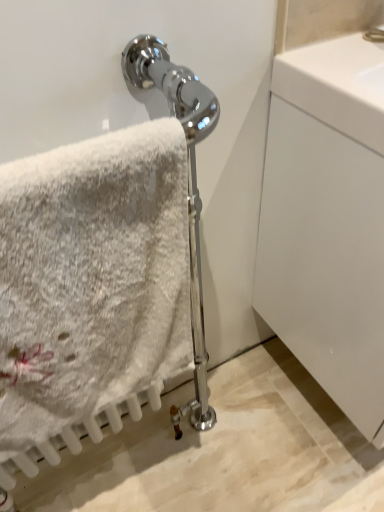
Question: Does white fluffy towel at left lie in front of white glossy cabinet at right?

Choices:
 (A) yes
 (B) no

Answer: (A)

Question: Is white fluffy towel at left not within white glossy cabinet at right?

Choices:
 (A) yes
 (B) no

Answer: (A)

Question: Can you confirm if white fluffy towel at left is smaller than white glossy cabinet at right?

Choices:
 (A) yes
 (B) no

Answer: (A)

Question: Is white fluffy towel at left to the right of white glossy cabinet at right from the viewer's perspective?

Choices:
 (A) yes
 (B) no

Answer: (B)

Question: Does white fluffy towel at left appear on the left side of white glossy cabinet at right?

Choices:
 (A) yes
 (B) no

Answer: (A)

Question: Considering the relative sizes of white fluffy towel at left and white glossy cabinet at right in the image provided, is white fluffy towel at left thinner than white glossy cabinet at right?

Choices:
 (A) yes
 (B) no

Answer: (A)

Question: Considering the relative sizes of white glossy cabinet at right and white fluffy towel at left in the image provided, is white glossy cabinet at right shorter than white fluffy towel at left?

Choices:
 (A) yes
 (B) no

Answer: (B)

Question: From a real-world perspective, is white glossy cabinet at right on top of white fluffy towel at left?

Choices:
 (A) no
 (B) yes

Answer: (A)

Question: Considering the relative sizes of white glossy cabinet at right and white fluffy towel at left in the image provided, is white glossy cabinet at right thinner than white fluffy towel at left?

Choices:
 (A) yes
 (B) no

Answer: (B)

Question: Could you tell me if white glossy cabinet at right is facing white fluffy towel at left?

Choices:
 (A) no
 (B) yes

Answer: (A)

Question: Is the depth of white glossy cabinet at right greater than that of white fluffy towel at left?

Choices:
 (A) yes
 (B) no

Answer: (A)

Question: Considering the relative positions of white glossy cabinet at right and white fluffy towel at left in the image provided, is white glossy cabinet at right to the right of white fluffy towel at left from the viewer's perspective?

Choices:
 (A) yes
 (B) no

Answer: (A)

Question: Is white fluffy towel at left wider or thinner than white glossy cabinet at right?

Choices:
 (A) thin
 (B) wide

Answer: (A)